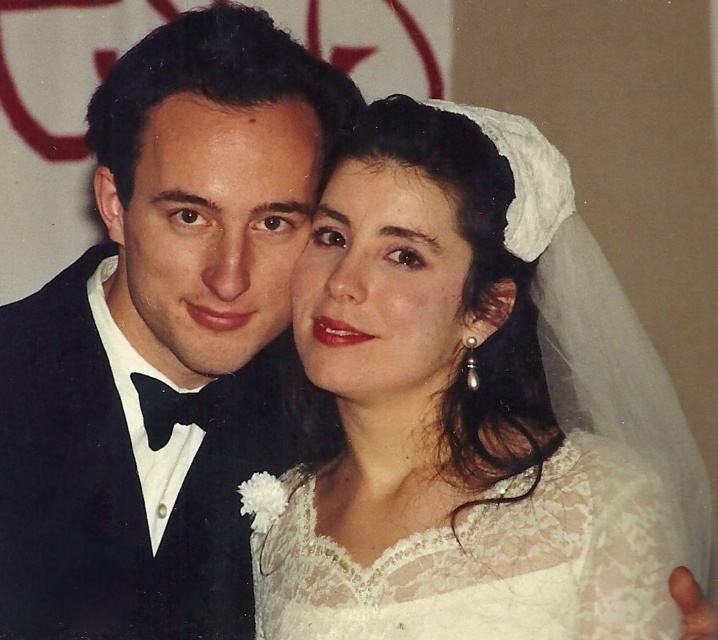
Question: Considering the real-world distances, which object is closest to the black satin tuxedo at left?

Choices:
 (A) white lace veil at upper center
 (B) white lace dress at center

Answer: (A)

Question: Which object is farther from the camera taking this photo?

Choices:
 (A) black satin tuxedo at left
 (B) white lace veil at upper center
 (C) white lace dress at center

Answer: (A)

Question: Which of the following is the farthest from the observer?

Choices:
 (A) (253, 468)
 (B) (456, 570)

Answer: (A)

Question: Does black satin tuxedo at left lie behind white lace dress at center?

Choices:
 (A) no
 (B) yes

Answer: (B)

Question: Does white lace veil at upper center appear on the left side of black satin tuxedo at left?

Choices:
 (A) yes
 (B) no

Answer: (B)

Question: Is white lace veil at upper center bigger than white lace dress at center?

Choices:
 (A) yes
 (B) no

Answer: (A)